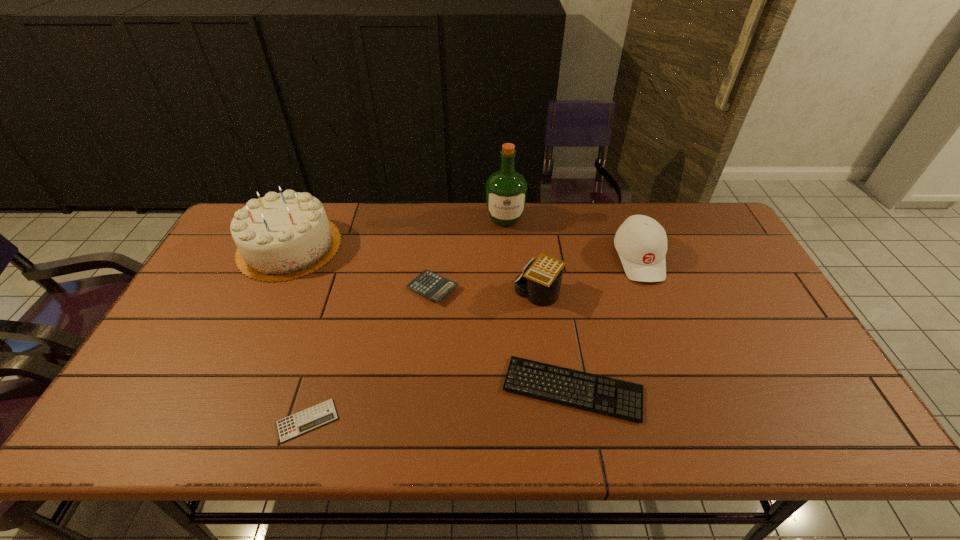
I want to click on the tallest object, so click(506, 190).

Locate an element on the screen. birthday cake is located at coordinates coord(282,236).

Locate an element on the screen. This screenshot has width=960, height=540. the rightmost object is located at coordinates (641, 242).

Locate an element on the screen. Image resolution: width=960 pixels, height=540 pixels. the rightmost calculator is located at coordinates (541, 283).

The image size is (960, 540). I want to click on the fifth object from right to left, so click(428, 284).

Identify the location of the second calculator from left to right. This screenshot has width=960, height=540. (428, 284).

Locate an element on the screen. This screenshot has width=960, height=540. computer keyboard is located at coordinates click(618, 398).

At what (x,y) coordinates should I click in order to perform the action: click on the nearest calculator. Please return your answer as a coordinate pair (x, y). Image resolution: width=960 pixels, height=540 pixels. Looking at the image, I should click on (323, 413).

Locate an element on the screen. Image resolution: width=960 pixels, height=540 pixels. the shortest object is located at coordinates point(323,413).

In order to click on blank space located 0.380m on the front-facing side of the liquor in this screenshot , I will do `click(512, 319)`.